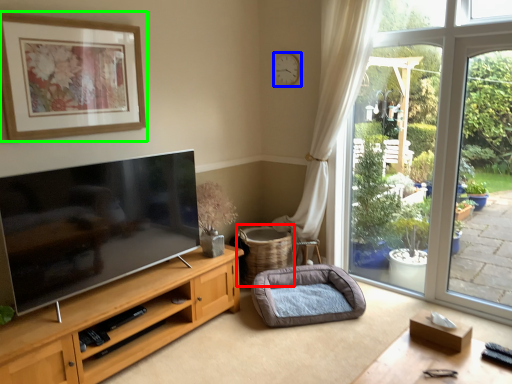
Question: Estimate the real-world distances between objects in this image. Which object is closer to basket (highlighted by a red box), clock (highlighted by a blue box) or picture frame (highlighted by a green box)?

Choices:
 (A) clock
 (B) picture frame

Answer: (A)